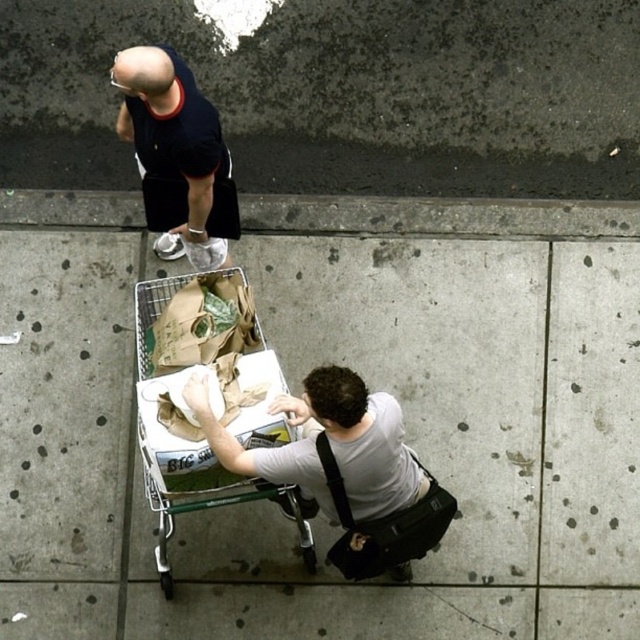
Question: Which point is farther from the camera taking this photo?

Choices:
 (A) tap(209, 216)
 (B) tap(464, 272)

Answer: (B)

Question: Is gray concrete sidewalk at center positioned in front of black matte shirt at upper left?

Choices:
 (A) yes
 (B) no

Answer: (B)

Question: Does concrete at upper center come in front of black matte shirt at upper left?

Choices:
 (A) no
 (B) yes

Answer: (A)

Question: Does black matte shirt at upper left lie behind white matte shirt at lower center?

Choices:
 (A) yes
 (B) no

Answer: (A)

Question: Among these points, which one is farthest from the camera?

Choices:
 (A) click(237, 412)
 (B) click(582, 540)
 (C) click(301, 442)

Answer: (B)

Question: Which of the following is the closest to the observer?

Choices:
 (A) black matte shirt at upper left
 (B) gray concrete sidewalk at center
 (C) metallic silver shopping cart at center
 (D) white matte shirt at lower center

Answer: (D)